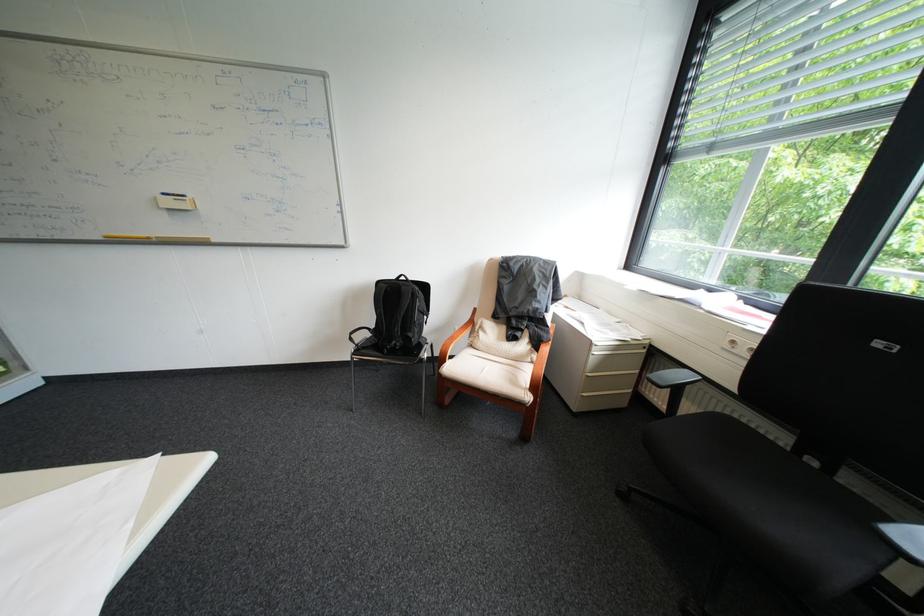
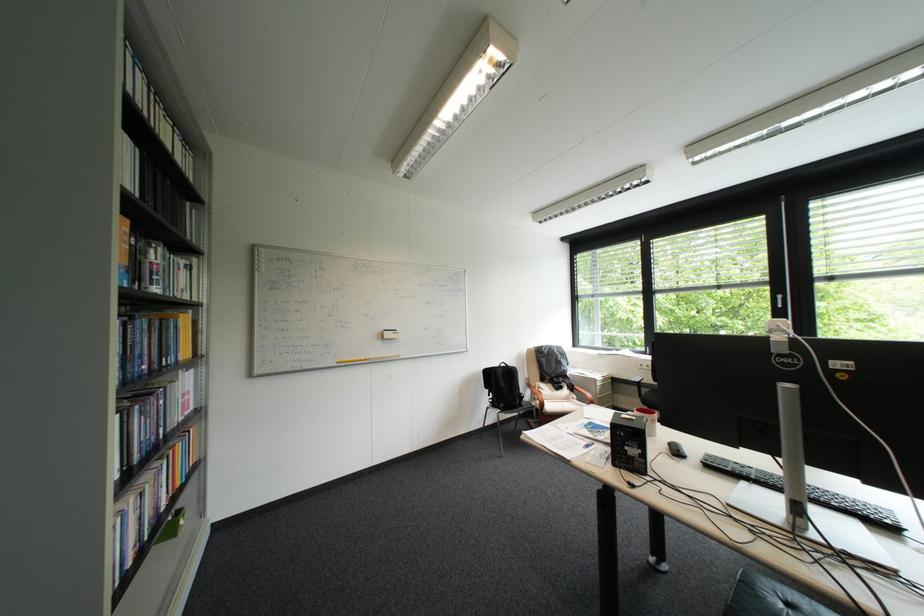
The point at (176, 195) is marked in the first image. Where is the corresponding point in the second image?

(397, 331)